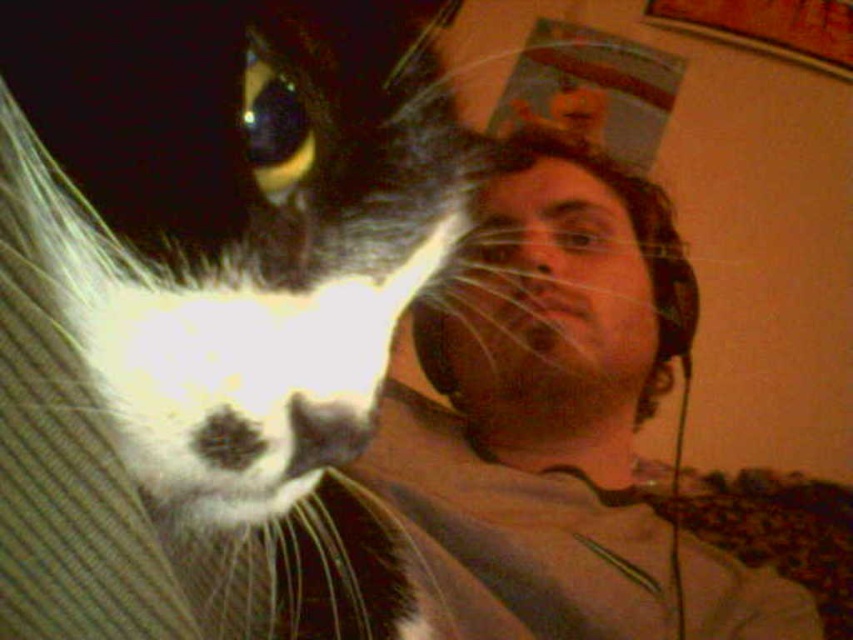
You are a photographer trying to capture the cat in the image. The cat is at point (221, 349). Where should you aim your camera to ensure the cat is centered in the frame?

The point (221, 349) indicates the black and white fur cat at left, so you should aim your camera at that coordinate to center the cat in the frame.

You are a photographer trying to capture a close shot of the black and white fur cat at left and the matte black headphones at upper right. Since you want both subjects to be in focus, you need to know which one is closer to the camera. Can you determine which is closer?

The black and white fur cat at left has a lesser height compared to the matte black headphones at upper right, so the cat is closer to the camera because objects closer to the camera appear larger in height than those further away.

You are trying to take a photo of the black and white fur cat at left and the matte black headphones at upper right. To ensure both are in frame, should you adjust your camera to the left or right?

The black and white fur cat at left is to the left of the matte black headphones at upper right, so you should adjust your camera to the right to ensure both are in frame.